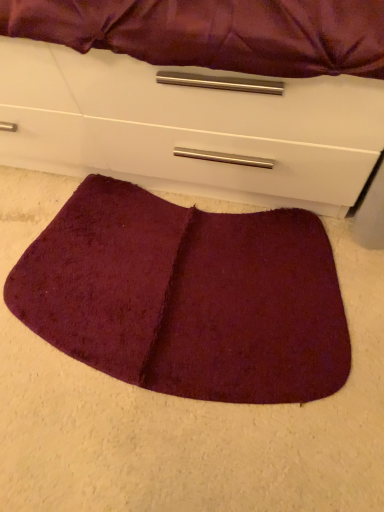
Question: From the image's perspective, is burgundy plush mat at lower center positioned above or below matte white chest of drawers at lower center?

Choices:
 (A) above
 (B) below

Answer: (B)

Question: In the image, is burgundy plush mat at lower center positioned in front of or behind matte white chest of drawers at lower center?

Choices:
 (A) behind
 (B) front

Answer: (A)

Question: Do you think burgundy plush mat at lower center is within matte white chest of drawers at lower center, or outside of it?

Choices:
 (A) inside
 (B) outside

Answer: (B)

Question: Considering the positions of point (218, 82) and point (231, 284), is point (218, 82) closer or farther from the camera than point (231, 284)?

Choices:
 (A) farther
 (B) closer

Answer: (B)

Question: From a real-world perspective, is matte white chest of drawers at lower center positioned above or below burgundy plush mat at lower center?

Choices:
 (A) below
 (B) above

Answer: (B)

Question: Would you say matte white chest of drawers at lower center is inside or outside burgundy plush mat at lower center?

Choices:
 (A) outside
 (B) inside

Answer: (A)

Question: Relative to burgundy plush mat at lower center, is matte white chest of drawers at lower center in front or behind?

Choices:
 (A) behind
 (B) front

Answer: (B)